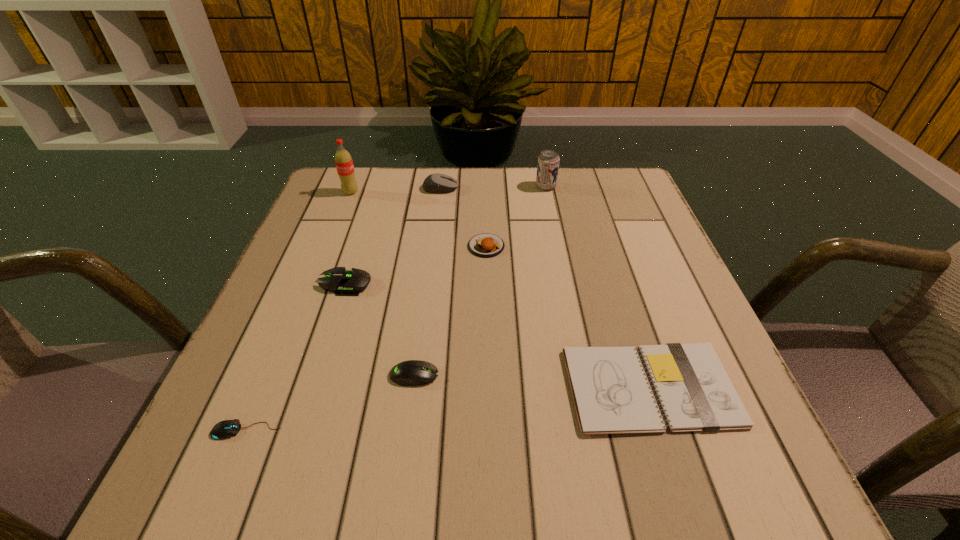
Find the location of a particular element. Image resolution: width=960 pixels, height=540 pixels. the tallest object is located at coordinates (344, 164).

You are a GUI agent. You are given a task and a screenshot of the screen. Output one action in this format:
    pyautogui.click(x=<x>, y=<y>)
    Task: Click on the seventh shortest object
    The image size is (960, 540).
    Given the screenshot: What is the action you would take?
    pyautogui.click(x=548, y=161)

Image resolution: width=960 pixels, height=540 pixels. I want to click on the third tallest object, so click(435, 183).

At what (x,y) coordinates should I click in order to perform the action: click on the tallest mouse. Please return your answer as a coordinate pair (x, y). Looking at the image, I should click on (435, 183).

I want to click on the third object from right to left, so click(486, 245).

At what (x,y) coordinates should I click in order to perform the action: click on the fifth nearest object. Please return your answer as a coordinate pair (x, y). Looking at the image, I should click on (486, 245).

At what (x,y) coordinates should I click in order to perform the action: click on the fourth nearest object. Please return your answer as a coordinate pair (x, y). Looking at the image, I should click on (342, 282).

The image size is (960, 540). I want to click on the second nearest mouse, so click(412, 372).

At what (x,y) coordinates should I click in order to perform the action: click on notepad. Please return your answer as a coordinate pair (x, y). The height and width of the screenshot is (540, 960). Looking at the image, I should click on (611, 392).

I want to click on the shortest mouse, so click(228, 428).